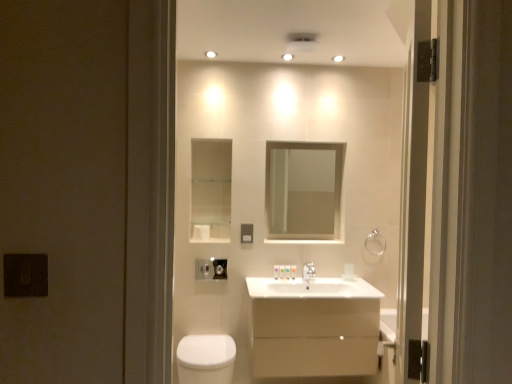
Find the location of a particular element. unoccupied area in front of translucent plastic tube at center, placed as the 1th toiletry when sorted from left to right is located at coordinates (268, 282).